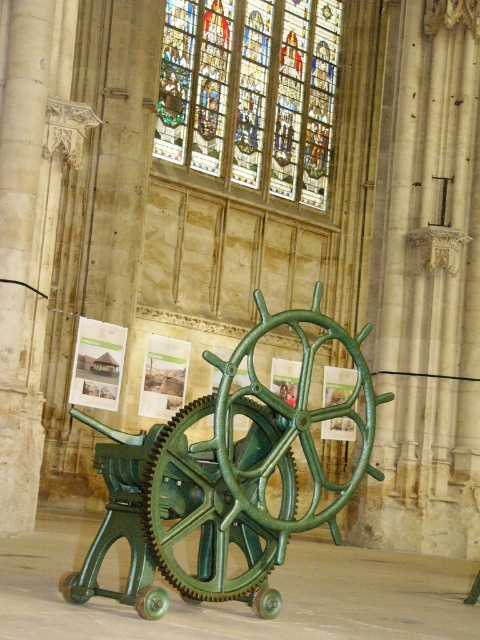
In the scene shown: You are standing at the entrance of the historic building and want to locate the green polished metal gear at center. According to the coordinates provided, where should you look relative to the entrance?

The green polished metal gear at center is located at coordinates point (223, 480), which means it is positioned towards the right side and slightly above the center of the image. Since you are at the entrance, you should look towards the right and slightly upwards from the entrance to find it.

Consider the image. You are an interior designer planning to install a new lighting fixture. You have two options to choose from. The first option is a pendant light that must be placed above the green polished metal gear at center. The second option is a chandelier that needs to be hung above the stained glass at upper center. Considering the height requirements, which location allows for a taller fixture?

The stained glass at upper center is taller than the green polished metal gear at center, so the chandelier can be hung there with more height available.

You are an interior designer planning to install a new lighting fixture. You want to ensure it doesn not block the view of the stained glass at upper center. Given that the green polished metal gear at center is currently in front of it, where should you place the new fixture?

The new lighting fixture should be placed behind the green polished metal gear at center since it is already blocking the view of the stained glass at upper center. This way, the fixture won t obstruct the stained glass at upper center further.